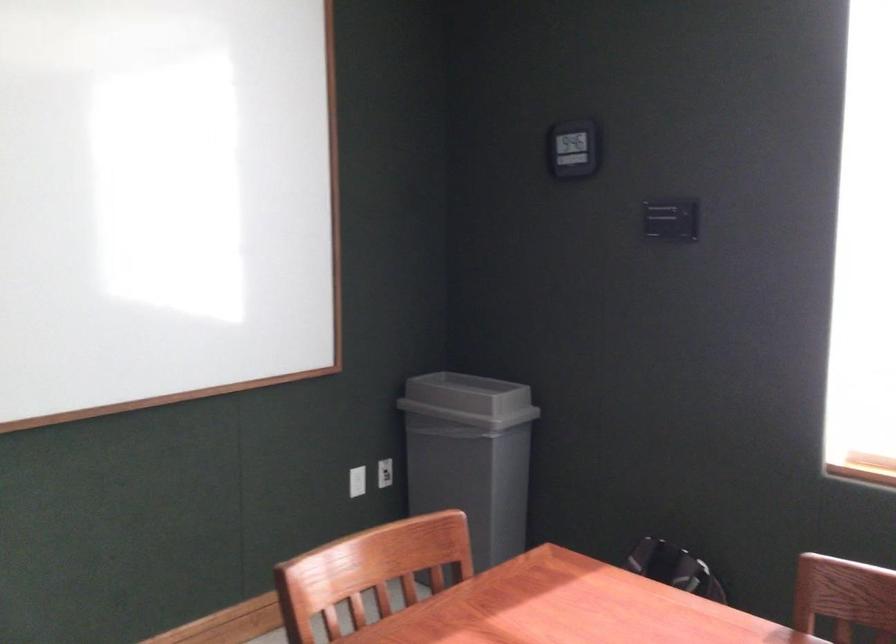
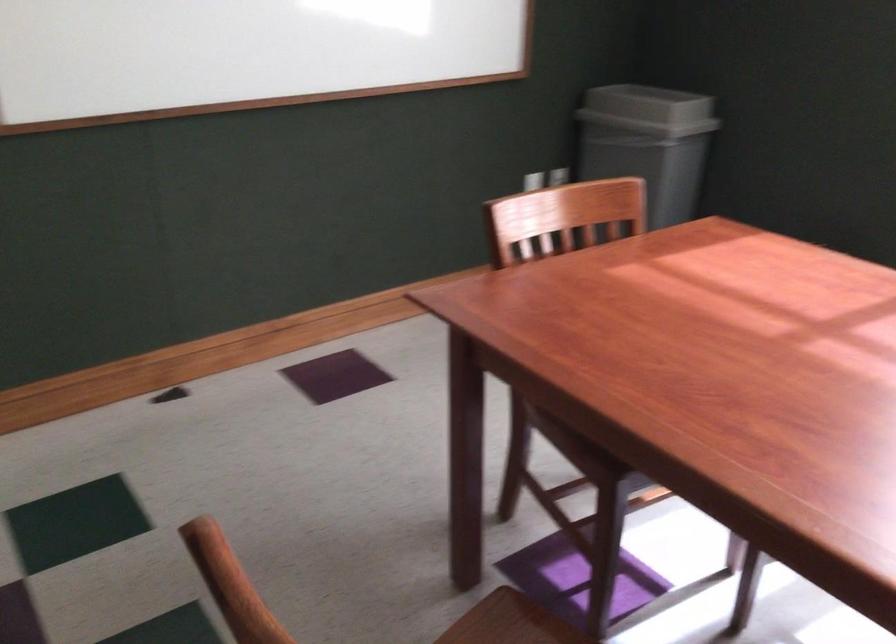
Question: The images are taken continuously from a first-person perspective. In which direction are you moving?

Choices:
 (A) Left
 (B) Right
 (C) Forward
 (D) Backward

Answer: (D)